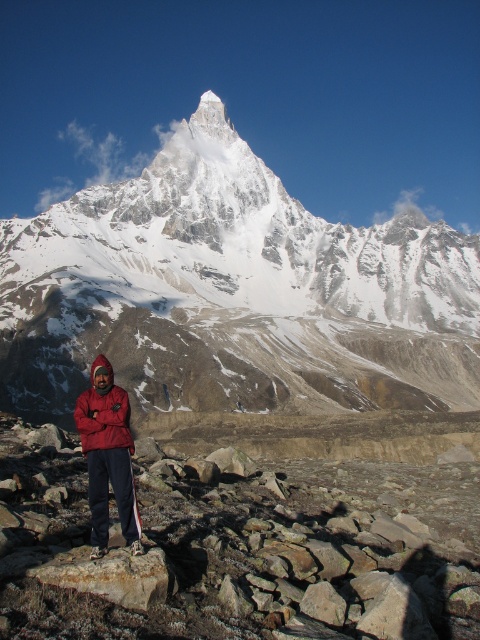
Question: Does snowy granite peak at upper center appear on the left side of matte red jacket at lower left?

Choices:
 (A) yes
 (B) no

Answer: (B)

Question: Which of the following is the closest to the observer?

Choices:
 (A) (381, 292)
 (B) (95, 442)

Answer: (B)

Question: Which object is farther from the camera taking this photo?

Choices:
 (A) red fleece jacket at lower left
 (B) snowy granite peak at upper center
 (C) matte red jacket at lower left

Answer: (B)

Question: Is snowy granite peak at upper center closer to camera compared to red fleece jacket at lower left?

Choices:
 (A) no
 (B) yes

Answer: (A)

Question: Among these points, which one is nearest to the camera?

Choices:
 (A) (132, 442)
 (B) (215, 275)

Answer: (A)

Question: Does snowy granite peak at upper center have a greater width compared to red fleece jacket at lower left?

Choices:
 (A) no
 (B) yes

Answer: (B)